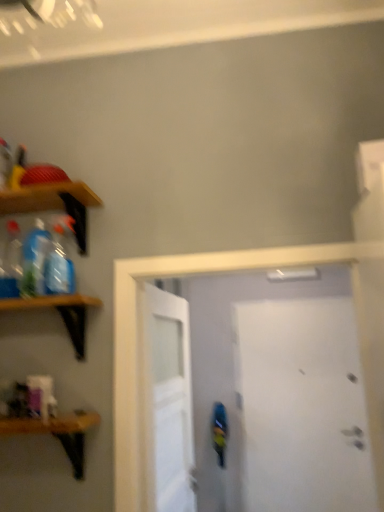
Locate an element on the screen. white matte door at center, the 1th door viewed from the front is located at coordinates (280, 392).

Describe the element at coordinates (280, 392) in the screenshot. This screenshot has width=384, height=512. I see `white matte door at center, the 1th door viewed from the front` at that location.

This screenshot has height=512, width=384. What do you see at coordinates (168, 403) in the screenshot?
I see `white matte door at center, which is the second door in front-to-back order` at bounding box center [168, 403].

Image resolution: width=384 pixels, height=512 pixels. What do you see at coordinates (58, 433) in the screenshot? I see `wooden shelf at lower left, acting as the 3th shelf starting from the top` at bounding box center [58, 433].

What do you see at coordinates (59, 260) in the screenshot?
I see `translucent plastic bottle at left, placed as the 1th bottle when sorted from right to left` at bounding box center [59, 260].

Where is `white matte door at right, which is the third door in front-to-back order`? white matte door at right, which is the third door in front-to-back order is located at coordinates (302, 406).

Measure the distance between wooden shelf at left, which ranks as the 2th shelf in top-to-bottom order, and camera.

The depth of wooden shelf at left, which ranks as the 2th shelf in top-to-bottom order, is 4.63 feet.

This screenshot has height=512, width=384. What do you see at coordinates (12, 261) in the screenshot?
I see `translucent plastic bottle at left, the 1th bottle positioned from the left` at bounding box center [12, 261].

You are a GUI agent. You are given a task and a screenshot of the screen. Output one action in this format:
    pyautogui.click(x=<x>, y=<y>)
    Task: Click on the white matte door at center, the 1th door viewed from the front
    
    Given the screenshot: What is the action you would take?
    pyautogui.click(x=280, y=392)

Is white matte door at right, which is the third door in front-to-back order, positioned far away from wooden shelf at lower left, acting as the 3th shelf starting from the top?

white matte door at right, which is the third door in front-to-back order, is positioned a significant distance from wooden shelf at lower left, acting as the 3th shelf starting from the top.

Is white matte door at right, which is the third door in front-to-back order, completely or partially outside of wooden shelf at lower left, acting as the 3th shelf starting from the top?

Absolutely, white matte door at right, which is the third door in front-to-back order, is external to wooden shelf at lower left, acting as the 3th shelf starting from the top.

From the picture: From a real-world perspective, between white matte door at right, which is the 1th door in back-to-front order, and wooden shelf at lower left, acting as the 3th shelf starting from the top, who is vertically higher?

wooden shelf at lower left, acting as the 3th shelf starting from the top, is physically above.

Is translucent plastic bottle at left, the 2th bottle when ordered from right to left, oriented away from white matte door at center, the 1th door viewed from the front?

No, translucent plastic bottle at left, the 2th bottle when ordered from right to left,'s orientation is not away from white matte door at center, the 1th door viewed from the front.

Is translucent plastic bottle at left, the 2th bottle when ordered from right to left, beside white matte door at center, the 1th door viewed from the front?

There is a gap between translucent plastic bottle at left, the 2th bottle when ordered from right to left, and white matte door at center, the 1th door viewed from the front.

Which is in front, point (36, 238) or point (298, 372)?

Positioned in front is point (36, 238).

Between translucent plastic bottle at left, which is the 2th bottle in left-to-right order, and white matte door at center, the 1th door viewed from the front, which one is positioned behind?

translucent plastic bottle at left, which is the 2th bottle in left-to-right order, is more distant.

Between white matte door at center, the 1th door viewed from the front, and wooden shelf at left, which ranks as the 2th shelf in top-to-bottom order, which one has smaller width?

white matte door at center, the 1th door viewed from the front.

From a real-world perspective, which object stands above the other?

wooden shelf at left, which is the 2th shelf in bottom-to-top order, from a real-world perspective.

You are a GUI agent. You are given a task and a screenshot of the screen. Output one action in this format:
    pyautogui.click(x=<x>, y=<y>)
    Task: Click on the shelf that is the 1st one when counting backward from the white matte door at center, which appears as the 3th door when viewed from the back
    
    Given the screenshot: What is the action you would take?
    pyautogui.click(x=60, y=313)

Is point (368, 496) farther from viewer compared to point (72, 317)?

Yes.

In the scene shown: From a real-world perspective, is white matte door at center, marked as the 2th door in a back-to-front arrangement, physically below white matte door at right, which is the 1th door in back-to-front order?

No, from a real-world perspective, white matte door at center, marked as the 2th door in a back-to-front arrangement, is not under white matte door at right, which is the 1th door in back-to-front order.

Does point (160, 426) appear closer or farther from the camera than point (250, 396)?

Clearly, point (160, 426) is closer to the camera than point (250, 396).

From the image's perspective, which is above, white matte door at center, marked as the 2th door in a back-to-front arrangement, or white matte door at right, which is the 1th door in back-to-front order?

white matte door at center, marked as the 2th door in a back-to-front arrangement.

From the image's perspective, is white matte door at center, which is the second door in front-to-back order, positioned above or below wooden shelf at left, which ranks as the 2th shelf in top-to-bottom order?

white matte door at center, which is the second door in front-to-back order, is below wooden shelf at left, which ranks as the 2th shelf in top-to-bottom order.

From a real-world perspective, is white matte door at center, marked as the 2th door in a back-to-front arrangement, under wooden shelf at left, which ranks as the 2th shelf in top-to-bottom order?

Yes, from a real-world perspective, white matte door at center, marked as the 2th door in a back-to-front arrangement, is under wooden shelf at left, which ranks as the 2th shelf in top-to-bottom order.

Is white matte door at center, which is the second door in front-to-back order, further to the viewer compared to wooden shelf at left, which is the 2th shelf in bottom-to-top order?

Yes, white matte door at center, which is the second door in front-to-back order, is further from the viewer.

Which of these two, white matte door at center, which is the second door in front-to-back order, or wooden shelf at left, which ranks as the 2th shelf in top-to-bottom order, stands shorter?

wooden shelf at left, which ranks as the 2th shelf in top-to-bottom order, is shorter.

Can you tell me how much translucent plastic bottle at left, which is the 2th bottle in left-to-right order, and translucent plastic bottle at left, placed as the 1th bottle when sorted from right to left, differ in facing direction?

translucent plastic bottle at left, which is the 2th bottle in left-to-right order, and translucent plastic bottle at left, placed as the 1th bottle when sorted from right to left, are facing 2.13 degrees away from each other.

Considering the sizes of objects translucent plastic bottle at left, the 2th bottle when ordered from right to left, and translucent plastic bottle at left, which appears as the 3th bottle when viewed from the left, in the image provided, who is bigger, translucent plastic bottle at left, the 2th bottle when ordered from right to left, or translucent plastic bottle at left, which appears as the 3th bottle when viewed from the left,?

translucent plastic bottle at left, the 2th bottle when ordered from right to left, is bigger.

Could you tell me if translucent plastic bottle at left, the 2th bottle when ordered from right to left, is facing translucent plastic bottle at left, which appears as the 3th bottle when viewed from the left?

No, translucent plastic bottle at left, the 2th bottle when ordered from right to left, is not turned towards translucent plastic bottle at left, which appears as the 3th bottle when viewed from the left.

Which of these two, translucent plastic bottle at left, the 2th bottle when ordered from right to left, or translucent plastic bottle at left, which appears as the 3th bottle when viewed from the left, stands taller?

translucent plastic bottle at left, which appears as the 3th bottle when viewed from the left.

Is white matte door at center, which is the second door in front-to-back order, in contact with wooden shelf at left, the third shelf positioned from the bottom?

white matte door at center, which is the second door in front-to-back order, and wooden shelf at left, the third shelf positioned from the bottom, are not in contact.

Is white matte door at center, marked as the 2th door in a back-to-front arrangement, further to camera compared to wooden shelf at left, the third shelf positioned from the bottom?

No, white matte door at center, marked as the 2th door in a back-to-front arrangement, is closer to the viewer.

From the image's perspective, is white matte door at center, which is the second door in front-to-back order, over wooden shelf at left, the third shelf positioned from the bottom?

Actually, white matte door at center, which is the second door in front-to-back order, appears below wooden shelf at left, the third shelf positioned from the bottom, in the image.

Where is `the 1st shelf counting from the left side of the white matte door at right, which is the 1th door in back-to-front order`? This screenshot has width=384, height=512. the 1st shelf counting from the left side of the white matte door at right, which is the 1th door in back-to-front order is located at coordinates (58, 433).

Image resolution: width=384 pixels, height=512 pixels. Identify the location of bottle that is the 2nd object above the white matte door at center, which appears as the 3th door when viewed from the back (from a real-world perspective). (34, 260).

When comparing their distances from white matte door at center, which is the second door in front-to-back order, does translucent plastic bottle at left, which is the 2th bottle in left-to-right order, or wooden shelf at lower left, acting as the 3th shelf starting from the top, seem closer?

wooden shelf at lower left, acting as the 3th shelf starting from the top, is closer to white matte door at center, which is the second door in front-to-back order.

Based on their spatial positions, is translucent plastic bottle at left, which appears as the 3th bottle when viewed from the left, or translucent plastic bottle at left, which is the 2th bottle in left-to-right order, further from wooden shelf at left, which ranks as the 2th shelf in top-to-bottom order?

translucent plastic bottle at left, which is the 2th bottle in left-to-right order.

Considering their positions, is translucent plastic bottle at left, which is the 2th bottle in left-to-right order, positioned closer to wooden shelf at left, which ranks as the first shelf in top-to-bottom order, than wooden shelf at left, which is the 2th shelf in bottom-to-top order?

translucent plastic bottle at left, which is the 2th bottle in left-to-right order, is closer to wooden shelf at left, which ranks as the first shelf in top-to-bottom order.

Based on their spatial positions, is white matte door at center, the 1th door viewed from the front, or wooden shelf at left, which is the 2th shelf in bottom-to-top order, further from translucent plastic bottle at left, which is the 2th bottle in left-to-right order?

white matte door at center, the 1th door viewed from the front.

Looking at the image, which one is located closer to white matte door at right, which is the 1th door in back-to-front order, translucent plastic bottle at left, the 1th bottle positioned from the left, or wooden shelf at left, the third shelf positioned from the bottom?

wooden shelf at left, the third shelf positioned from the bottom.

Considering their positions, is white matte door at center, the 1th door viewed from the front, positioned further to wooden shelf at lower left, placed as the first shelf when sorted from bottom to top, than translucent plastic bottle at left, the 2th bottle when ordered from right to left?

white matte door at center, the 1th door viewed from the front, is further to wooden shelf at lower left, placed as the first shelf when sorted from bottom to top.

When comparing their distances from wooden shelf at left, which ranks as the 2th shelf in top-to-bottom order, does white matte door at center, which is the second door in front-to-back order, or translucent plastic bottle at left, placed as the 1th bottle when sorted from right to left, seem closer?

translucent plastic bottle at left, placed as the 1th bottle when sorted from right to left.

Looking at the image, which one is located closer to wooden shelf at left, the third shelf positioned from the bottom, translucent plastic bottle at left, the 2th bottle when ordered from right to left, or white matte door at center, which appears as the 3th door when viewed from the back?

translucent plastic bottle at left, the 2th bottle when ordered from right to left, is closer to wooden shelf at left, the third shelf positioned from the bottom.

The image size is (384, 512). In order to click on shelf positioned between translucent plastic bottle at left, the 2th bottle when ordered from right to left, and white matte door at right, which is the third door in front-to-back order, from near to far in this screenshot , I will do `click(54, 204)`.

The image size is (384, 512). I want to click on door between translucent plastic bottle at left, the 2th bottle when ordered from right to left, and white matte door at right, which is the 1th door in back-to-front order, along the z-axis, so click(x=168, y=403).

In order to click on bottle located between wooden shelf at lower left, placed as the first shelf when sorted from bottom to top, and white matte door at center, which appears as the 3th door when viewed from the back, in the left-right direction in this screenshot , I will do `click(59, 260)`.

Where is `shelf between translucent plastic bottle at left, the 1th bottle positioned from the left, and translucent plastic bottle at left, the 2th bottle when ordered from right to left, in the horizontal direction`? shelf between translucent plastic bottle at left, the 1th bottle positioned from the left, and translucent plastic bottle at left, the 2th bottle when ordered from right to left, in the horizontal direction is located at coordinates (54, 204).